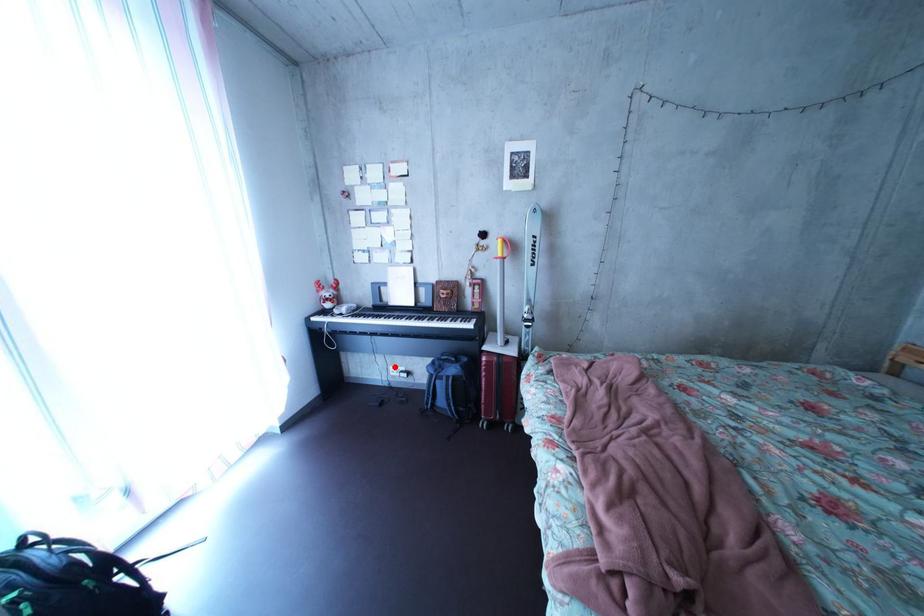
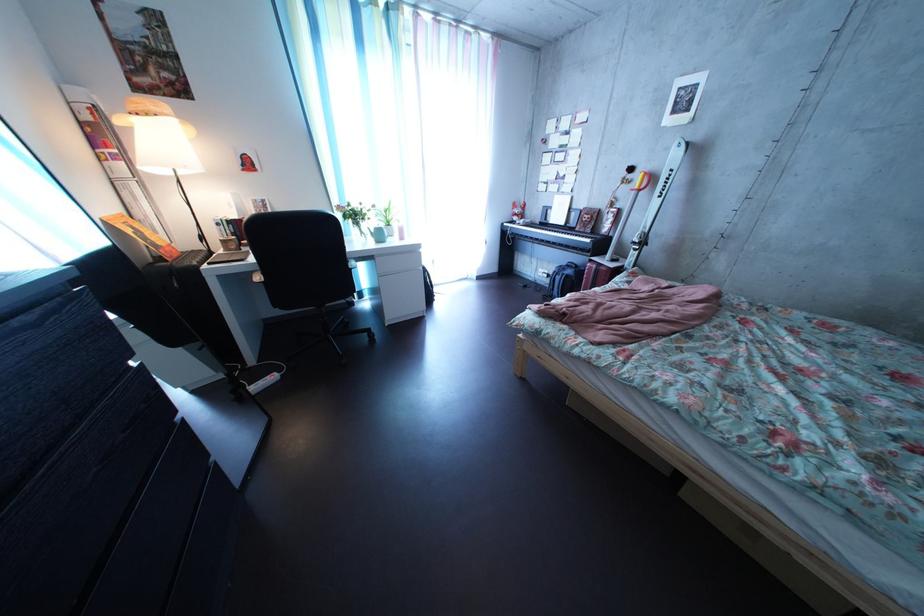
Locate, in the second image, the point that corresponds to the highlighted location in the first image.

(550, 269)